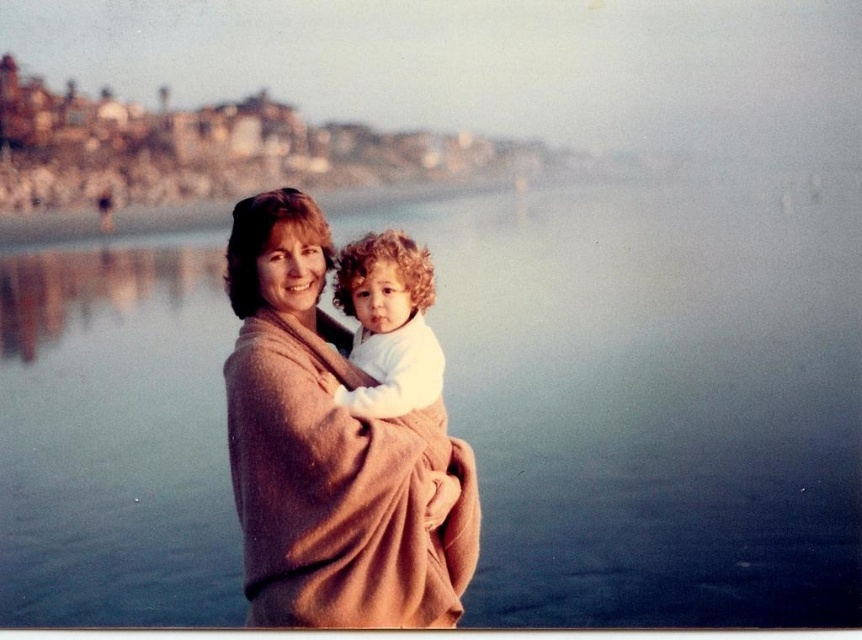
Consider the image. Does blue water at center have a greater height compared to beige wool sweater at center?

Yes.

Looking at this image, can you confirm if blue water at center is positioned below beige wool sweater at center?

No, blue water at center is not below beige wool sweater at center.

Which is in front, point (82, 337) or point (261, 544)?

Positioned in front is point (261, 544).

In order to click on blue water at center in this screenshot , I will do `click(656, 396)`.

Is the position of beige wool sweater at center more distant than that of white soft fabric at center?

That is False.

Does beige wool sweater at center come in front of white soft fabric at center?

Yes, beige wool sweater at center is closer to the viewer.

In order to click on beige wool sweater at center in this screenshot , I will do `click(330, 451)`.

Locate an element on the screen. beige wool sweater at center is located at coordinates point(330,451).

Describe the element at coordinates (656, 396) in the screenshot. The height and width of the screenshot is (640, 862). I see `blue water at center` at that location.

The image size is (862, 640). I want to click on blue water at center, so click(656, 396).